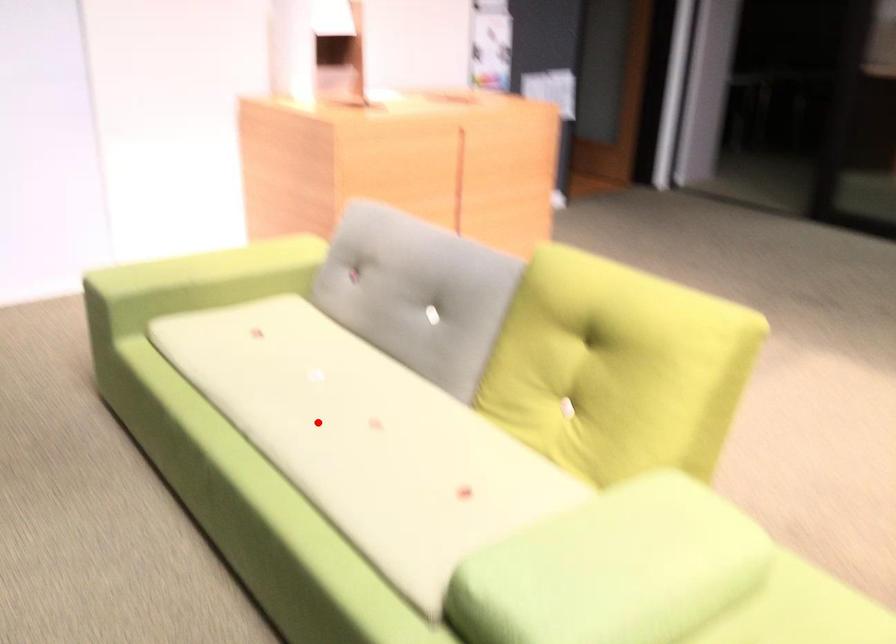
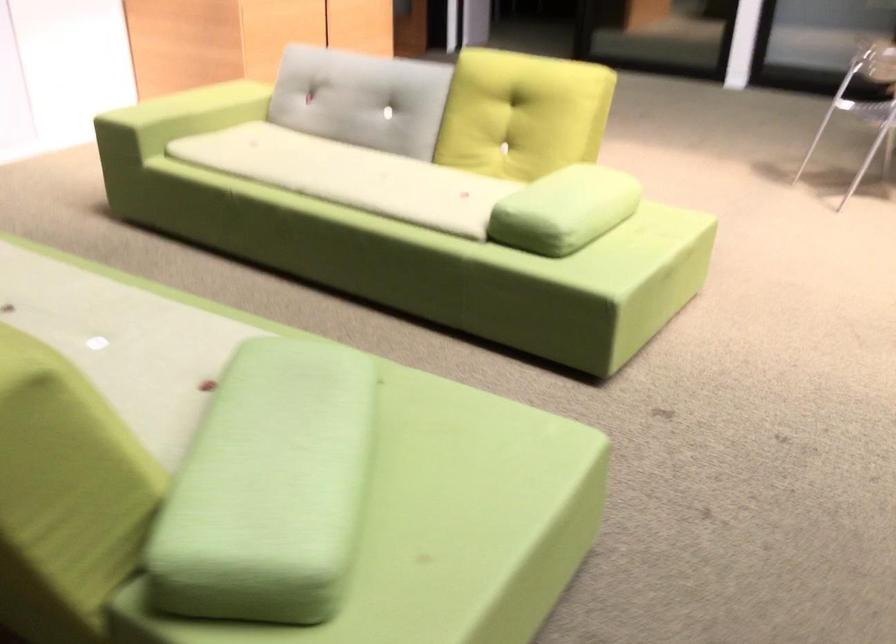
Question: I am providing you with two images of the same scene from different viewpoints. A red point is marked on the first image. Can you still see the location of the red point in image 2?

Choices:
 (A) Yes
 (B) No

Answer: (A)